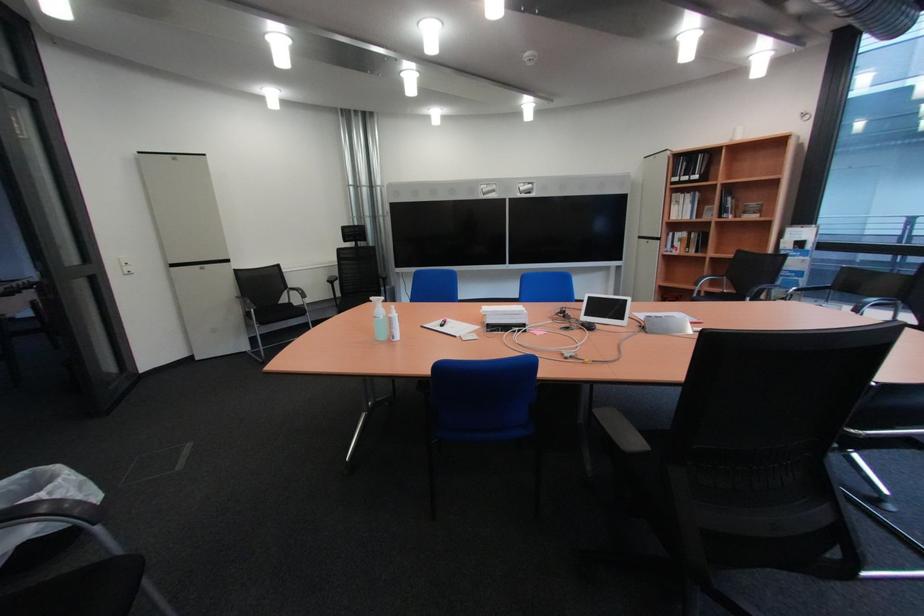
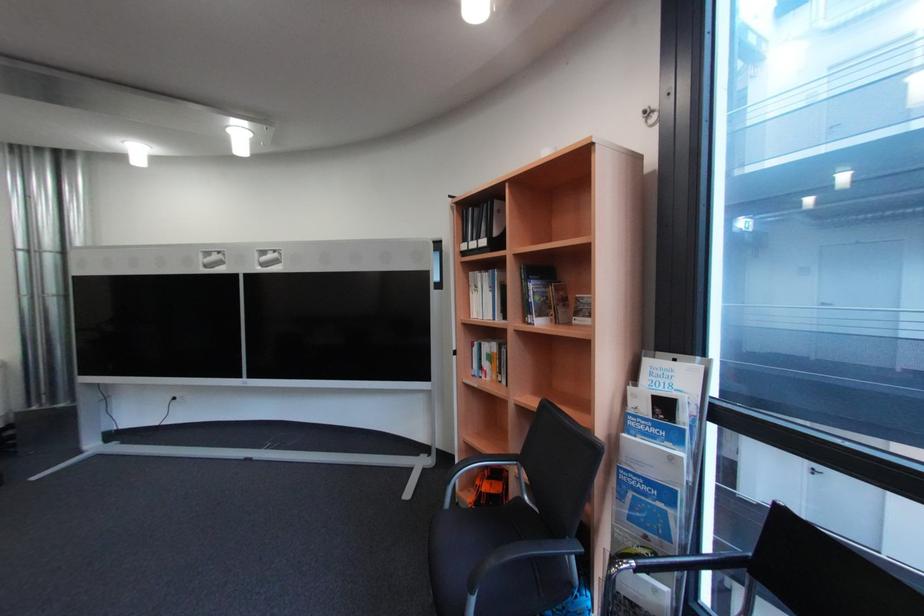
What movement of the cameraman would produce the second image?

The cameraman moved toward right, forward.